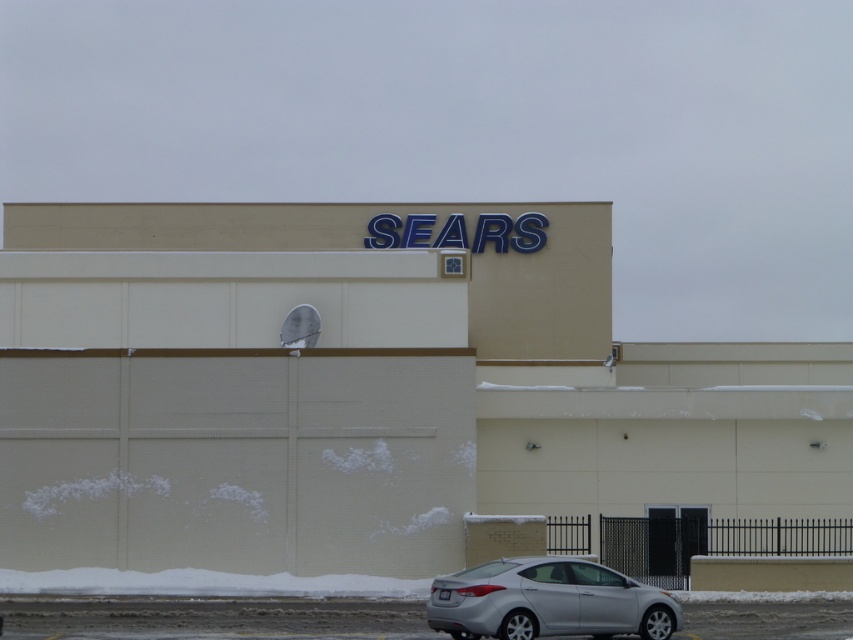
You are standing at point (376, 396). What is the object directly beneath your feet?

The beige matte building at center is directly beneath the point (376, 396).